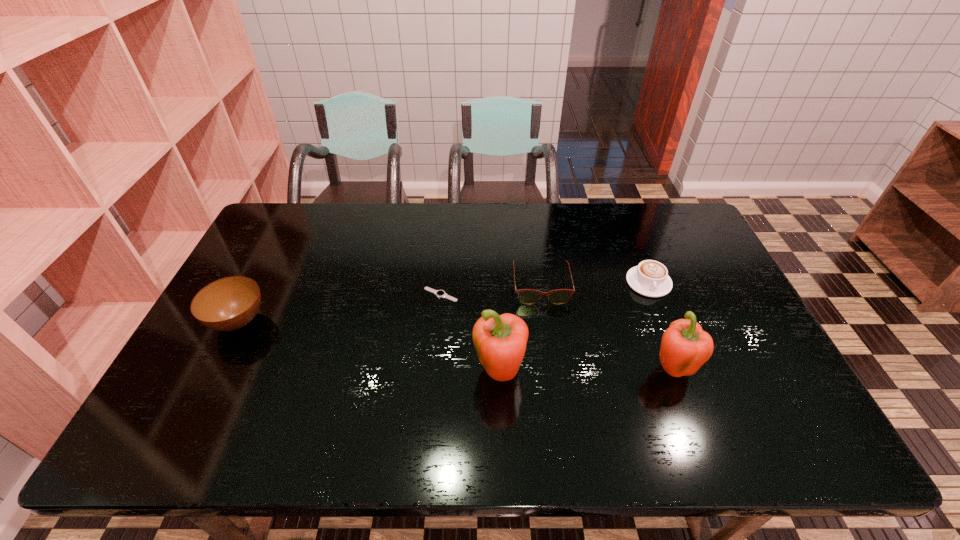
I want to click on the taller pepper, so click(x=500, y=341).

Find the location of a particular element. The width and height of the screenshot is (960, 540). the left pepper is located at coordinates (500, 341).

Where is `the second tallest object`? Image resolution: width=960 pixels, height=540 pixels. the second tallest object is located at coordinates (685, 347).

At what (x,y) coordinates should I click in order to perform the action: click on the right pepper. Please return your answer as a coordinate pair (x, y). This screenshot has height=540, width=960. Looking at the image, I should click on (685, 347).

This screenshot has height=540, width=960. I want to click on the second object from left to right, so click(x=439, y=293).

You are a GUI agent. You are given a task and a screenshot of the screen. Output one action in this format:
    pyautogui.click(x=<x>, y=<y>)
    Task: Click on the shortest object
    The image size is (960, 540).
    Given the screenshot: What is the action you would take?
    pyautogui.click(x=439, y=293)

Where is `cappuccino`? Image resolution: width=960 pixels, height=540 pixels. cappuccino is located at coordinates (650, 278).

Find the location of a particular element. The width and height of the screenshot is (960, 540). spectacles is located at coordinates (526, 296).

Find the location of a particular element. The image size is (960, 540). bowl is located at coordinates (227, 304).

Where is `the fourth shortest object`? the fourth shortest object is located at coordinates (227, 304).